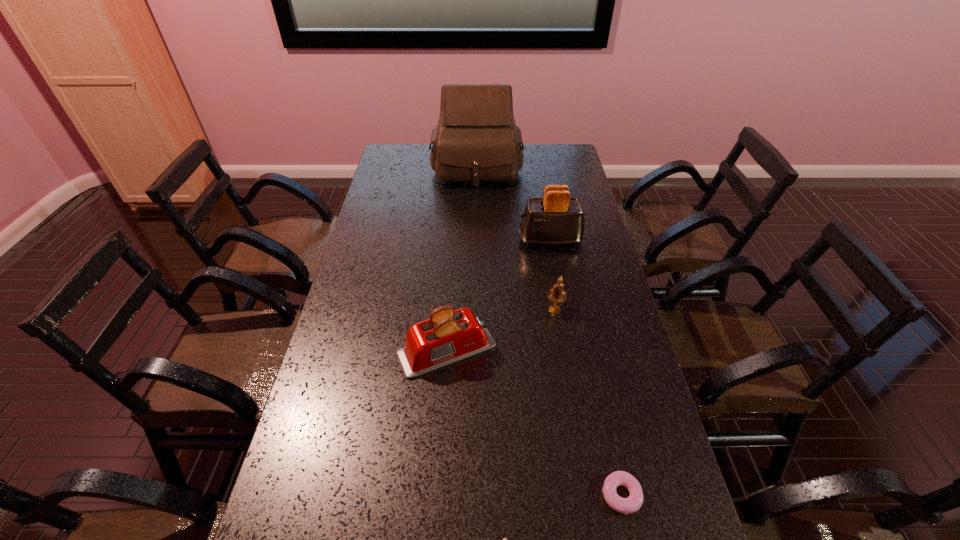
Locate an element on the screen. This screenshot has height=540, width=960. vacant area situated 0.120m on the side of the taller toaster with the control lever is located at coordinates (485, 240).

Where is `vacant region located 0.380m on the side of the taller toaster with the control lever`? This screenshot has width=960, height=540. vacant region located 0.380m on the side of the taller toaster with the control lever is located at coordinates (413, 240).

At what (x,y) coordinates should I click in order to perform the action: click on vacant space located on the side of the taller toaster with the control lever. Please return your answer as a coordinate pair (x, y). Looking at the image, I should click on (410, 240).

Find the location of a particular element. This screenshot has width=960, height=540. blank area located on the back of the left toaster is located at coordinates (452, 268).

You are a GUI agent. You are given a task and a screenshot of the screen. Output one action in this format:
    pyautogui.click(x=<x>, y=<y>)
    Task: Click on the free space located on the right of the fourth nearest object
    
    Given the screenshot: What is the action you would take?
    pyautogui.click(x=603, y=309)

This screenshot has height=540, width=960. In order to click on vacant space located 0.400m on the back of the second nearest object in this screenshot , I will do `click(587, 335)`.

In order to click on object present at the far edge in this screenshot , I will do `click(476, 140)`.

At what (x,y) coordinates should I click in order to perform the action: click on toaster that is at the right edge. Please return your answer as a coordinate pair (x, y). The width and height of the screenshot is (960, 540). Looking at the image, I should click on (556, 219).

Image resolution: width=960 pixels, height=540 pixels. What are the coordinates of `doughnut present at the right edge` in the screenshot? It's located at (633, 503).

The height and width of the screenshot is (540, 960). What are the coordinates of `free spot at the left edge of the desktop` in the screenshot? It's located at (320, 491).